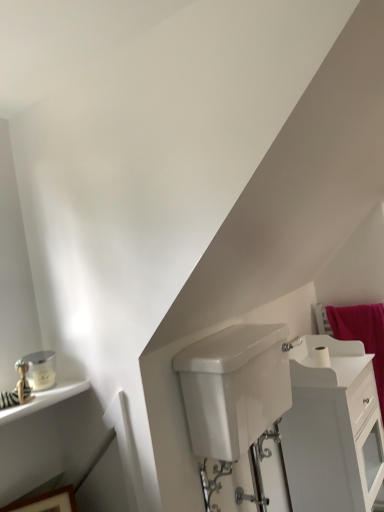
Question: Is white matte toilet paper at upper right in front of wooden picture frame at lower left?

Choices:
 (A) yes
 (B) no

Answer: (B)

Question: From a real-world perspective, does white matte toilet paper at upper right stand above wooden picture frame at lower left?

Choices:
 (A) no
 (B) yes

Answer: (B)

Question: Are white matte toilet paper at upper right and wooden picture frame at lower left located far from each other?

Choices:
 (A) yes
 (B) no

Answer: (A)

Question: Is white matte toilet paper at upper right at the right side of wooden picture frame at lower left?

Choices:
 (A) no
 (B) yes

Answer: (B)

Question: Is white matte toilet paper at upper right facing away from wooden picture frame at lower left?

Choices:
 (A) no
 (B) yes

Answer: (A)

Question: Relative to white glossy tank at lower center, is white glossy cabinet at lower right in front or behind?

Choices:
 (A) front
 (B) behind

Answer: (B)

Question: From a real-world perspective, is white glossy cabinet at lower right physically located above or below white glossy tank at lower center?

Choices:
 (A) above
 (B) below

Answer: (B)

Question: Considering the relative positions of white glossy cabinet at lower right and white glossy tank at lower center in the image provided, is white glossy cabinet at lower right to the left or to the right of white glossy tank at lower center?

Choices:
 (A) right
 (B) left

Answer: (A)

Question: Is white glossy cabinet at lower right wider or thinner than white glossy tank at lower center?

Choices:
 (A) wide
 (B) thin

Answer: (A)

Question: From the image's perspective, is white matte toilet paper at upper right above or below white glossy tank at lower center?

Choices:
 (A) below
 (B) above

Answer: (A)

Question: In the image, is white matte toilet paper at upper right positioned in front of or behind white glossy tank at lower center?

Choices:
 (A) behind
 (B) front

Answer: (A)

Question: Do you think white matte toilet paper at upper right is within white glossy tank at lower center, or outside of it?

Choices:
 (A) inside
 (B) outside

Answer: (B)

Question: Looking at the image, does white matte toilet paper at upper right seem bigger or smaller compared to white glossy tank at lower center?

Choices:
 (A) small
 (B) big

Answer: (A)

Question: Is white glossy cabinet at lower right bigger or smaller than white matte toilet paper at upper right?

Choices:
 (A) big
 (B) small

Answer: (A)

Question: From a real-world perspective, relative to white matte toilet paper at upper right, is white glossy cabinet at lower right vertically above or below?

Choices:
 (A) below
 (B) above

Answer: (A)